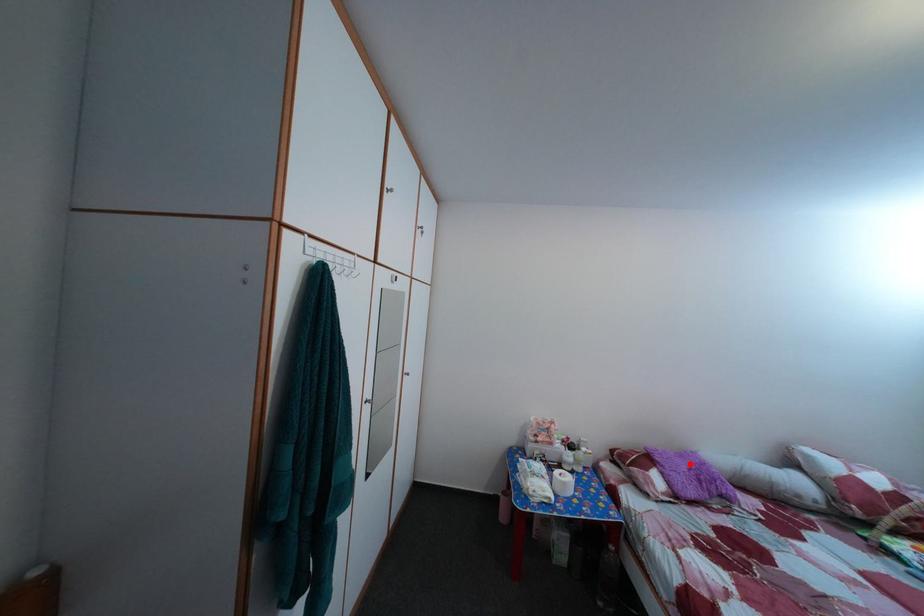
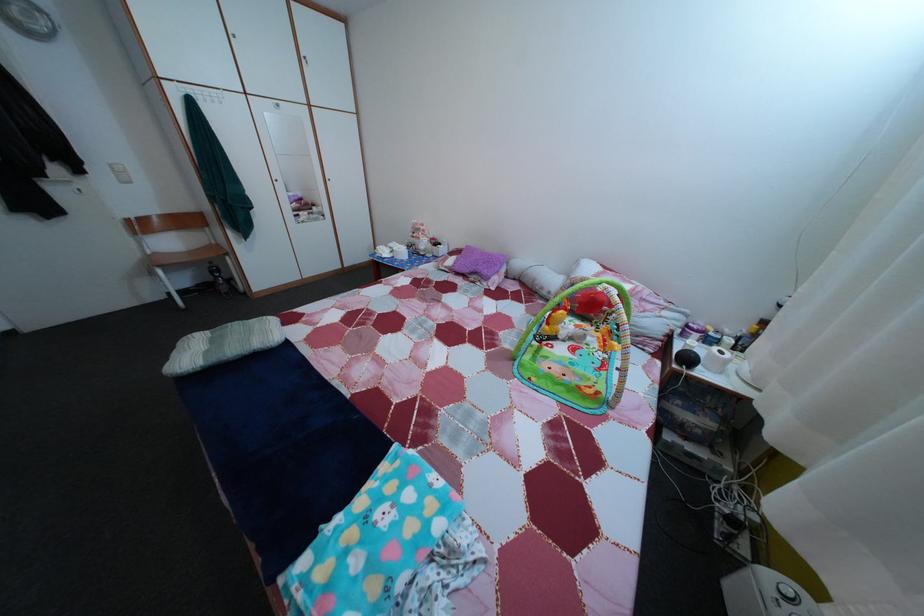
Question: I am providing you with two images of the same scene from different viewpoints. Given a red point in image1, look at the same physical point in image2. Is it:

Choices:
 (A) Closer to the viewpoint
 (B) Farther from the viewpoint

Answer: (A)